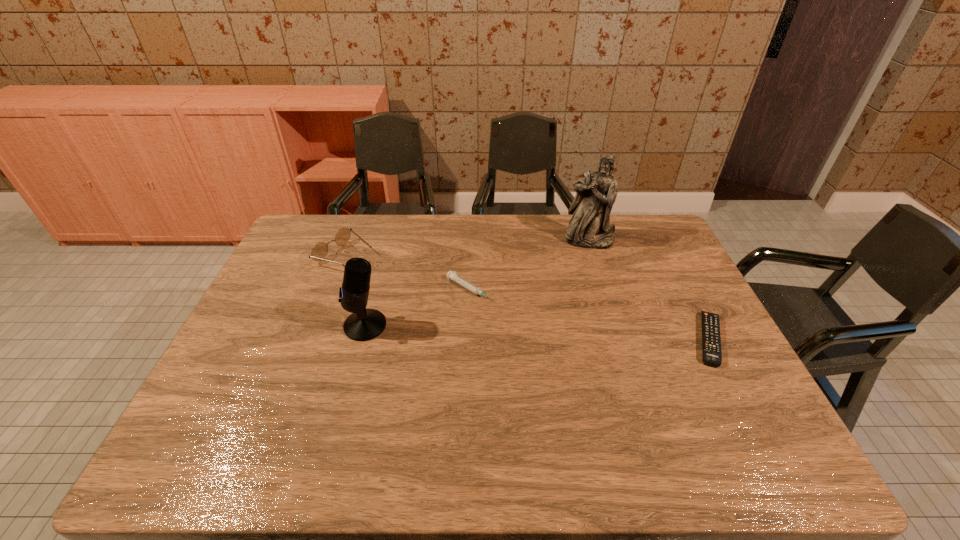
Locate an element on the screen. microphone is located at coordinates (363, 324).

In order to click on remote control in this screenshot , I will do `click(711, 340)`.

This screenshot has height=540, width=960. I want to click on the rightmost object, so click(x=711, y=340).

Where is `spectacles`? This screenshot has width=960, height=540. spectacles is located at coordinates (320, 250).

You are a GUI agent. You are given a task and a screenshot of the screen. Output one action in this format:
    pyautogui.click(x=<x>, y=<y>)
    Task: Click on the third object from right to left
    Image resolution: width=960 pixels, height=540 pixels.
    Given the screenshot: What is the action you would take?
    pyautogui.click(x=450, y=275)

At what (x,y) coordinates should I click in order to perform the action: click on the third farthest object. Please return your answer as a coordinate pair (x, y). The image size is (960, 540). Looking at the image, I should click on (450, 275).

Find the location of `the second object from right to left`. the second object from right to left is located at coordinates (589, 227).

Locate an element on the screen. the tallest object is located at coordinates (589, 227).

Locate an element on the screen. The image size is (960, 540). vacant region located on the stand of the second tallest object is located at coordinates (316, 326).

The height and width of the screenshot is (540, 960). I want to click on vacant position located on the stand of the second tallest object, so click(x=276, y=326).